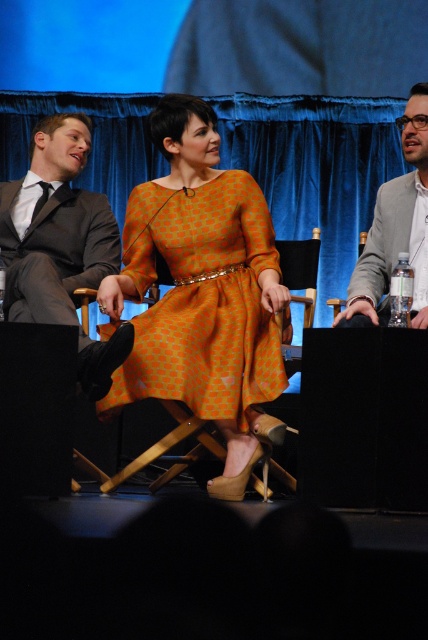
Question: Does dark gray suit at left come behind matte gray blazer at right?

Choices:
 (A) yes
 (B) no

Answer: (A)

Question: Among these objects, which one is farthest from the camera?

Choices:
 (A) dark gray suit at left
 (B) orange printed dress at center
 (C) matte gray blazer at right
 (D) blue velvet curtain at upper center

Answer: (D)

Question: Which object appears closest to the camera in this image?

Choices:
 (A) dark gray suit at left
 (B) blue velvet curtain at upper center

Answer: (A)

Question: In this image, where is blue velvet curtain at upper center located relative to dark gray suit at left?

Choices:
 (A) below
 (B) above

Answer: (B)

Question: Is the position of blue velvet curtain at upper center less distant than that of dark gray suit at left?

Choices:
 (A) no
 (B) yes

Answer: (A)

Question: Among these points, which one is farthest from the camera?

Choices:
 (A) (309, 200)
 (B) (74, 321)
 (C) (168, 360)

Answer: (A)